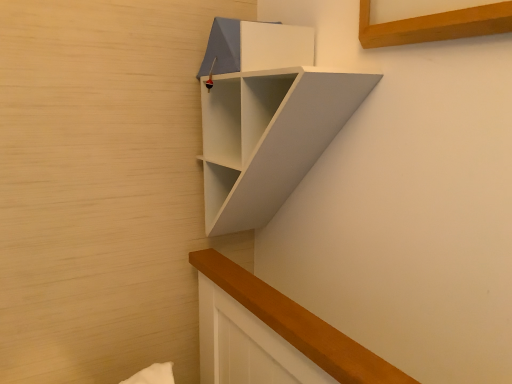
This screenshot has height=384, width=512. What do you see at coordinates (268, 137) in the screenshot? I see `white matte shelf at upper center` at bounding box center [268, 137].

Find the location of a particular element. This screenshot has height=384, width=512. white matte shelf at upper center is located at coordinates (268, 137).

I want to click on white matte cabinet at upper center, so click(x=256, y=46).

Describe the element at coordinates (256, 46) in the screenshot. I see `white matte cabinet at upper center` at that location.

Identify the location of white matte shelf at upper center. The height and width of the screenshot is (384, 512). 268,137.

Would you say white matte shelf at upper center is to the left or to the right of white matte cabinet at upper center in the picture?

Clearly, white matte shelf at upper center is on the right of white matte cabinet at upper center in the image.

Who is more distant, white matte shelf at upper center or white matte cabinet at upper center?

Positioned behind is white matte cabinet at upper center.

Considering the positions of points (249, 135) and (221, 42), is point (249, 135) closer to camera compared to point (221, 42)?

Yes, point (249, 135) is closer to viewer.

From the image's perspective, relative to white matte cabinet at upper center, is white matte shelf at upper center above or below?

white matte shelf at upper center is below white matte cabinet at upper center.

From a real-world perspective, is white matte shelf at upper center physically above white matte cabinet at upper center?

No, from a real-world perspective, white matte shelf at upper center is not on top of white matte cabinet at upper center.

Which of these two, white matte shelf at upper center or white matte cabinet at upper center, is wider?

Wider between the two is white matte shelf at upper center.

Between white matte shelf at upper center and white matte cabinet at upper center, which one has more height?

white matte shelf at upper center is taller.

Which of these two, white matte shelf at upper center or white matte cabinet at upper center, is smaller?

white matte cabinet at upper center.

Which is correct: white matte shelf at upper center is inside white matte cabinet at upper center, or outside of it?

white matte shelf at upper center is spatially situated outside white matte cabinet at upper center.

Does white matte shelf at upper center touch white matte cabinet at upper center?

There is a gap between white matte shelf at upper center and white matte cabinet at upper center.

Does white matte shelf at upper center turn towards white matte cabinet at upper center?

No, white matte shelf at upper center is not facing towards white matte cabinet at upper center.

The width and height of the screenshot is (512, 384). Identify the location of cabinet above the white matte shelf at upper center (from the image's perspective). (256, 46).

Considering the positions of objects white matte cabinet at upper center and white matte shelf at upper center in the image provided, who is more to the left, white matte cabinet at upper center or white matte shelf at upper center?

Positioned to the left is white matte cabinet at upper center.

Which object is closer to the camera taking this photo, white matte cabinet at upper center or white matte shelf at upper center?

Result: white matte shelf at upper center is closer to the camera.

Does point (225, 58) appear closer or farther from the camera than point (281, 72)?

Point (225, 58) is farther from the camera than point (281, 72).

From the image's perspective, would you say white matte cabinet at upper center is shown under white matte shelf at upper center?

No.

From a real-world perspective, relative to white matte shelf at upper center, is white matte cabinet at upper center vertically above or below?

In terms of real-world spatial position, white matte cabinet at upper center is above white matte shelf at upper center.

Is white matte cabinet at upper center wider or thinner than white matte shelf at upper center?

Considering their sizes, white matte cabinet at upper center looks slimmer than white matte shelf at upper center.

Can you confirm if white matte cabinet at upper center is taller than white matte shelf at upper center?

No.

Considering the sizes of objects white matte cabinet at upper center and white matte shelf at upper center in the image provided, who is bigger, white matte cabinet at upper center or white matte shelf at upper center?

With larger size is white matte shelf at upper center.

Is white matte cabinet at upper center positioned beyond the bounds of white matte shelf at upper center?

No, white matte cabinet at upper center is not entirely external to white matte shelf at upper center.

In the scene shown: Is white matte cabinet at upper center not near white matte shelf at upper center?

That's not correct — white matte cabinet at upper center is a little close to white matte shelf at upper center.

Is white matte cabinet at upper center oriented away from white matte shelf at upper center?

Yes.

Find the location of `shelf below the white matte cabinet at upper center (from the image's perspective)`. shelf below the white matte cabinet at upper center (from the image's perspective) is located at coordinates (268, 137).

Where is `cabinet that appears above the white matte shelf at upper center (from the image's perspective)`? Image resolution: width=512 pixels, height=384 pixels. cabinet that appears above the white matte shelf at upper center (from the image's perspective) is located at coordinates (256, 46).

Where is `cabinet above the white matte shelf at upper center (from a real-world perspective)`? The image size is (512, 384). cabinet above the white matte shelf at upper center (from a real-world perspective) is located at coordinates (256, 46).